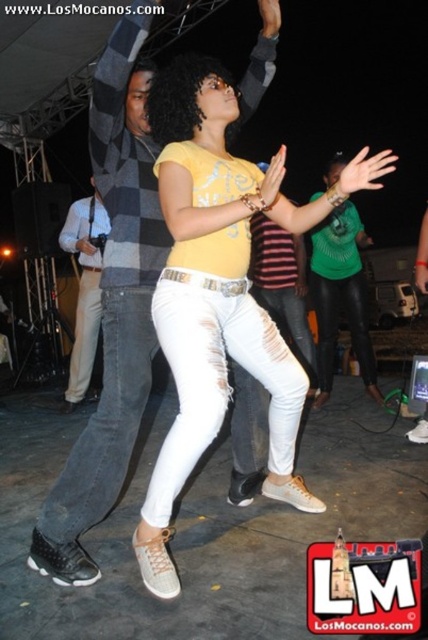
Between matte yellow shirt at center and green matte shirt at center, which one is positioned higher?

green matte shirt at center is higher up.

Can you confirm if matte yellow shirt at center is taller than green matte shirt at center?

In fact, matte yellow shirt at center may be shorter than green matte shirt at center.

Describe the element at coordinates (220, 292) in the screenshot. I see `matte yellow shirt at center` at that location.

The image size is (428, 640). In order to click on matte yellow shirt at center in this screenshot , I will do `click(220, 292)`.

Can you confirm if denim jeans at center is bigger than green matte shirt at center?

No.

Is denim jeans at center wider than green matte shirt at center?

In fact, denim jeans at center might be narrower than green matte shirt at center.

Is point (51, 556) behind point (329, 323)?

That is False.

Where is `denim jeans at center`? denim jeans at center is located at coordinates (112, 308).

Is green matte shirt at center below light blue shirt at left?

Incorrect, green matte shirt at center is not positioned below light blue shirt at left.

Does green matte shirt at center appear on the right side of light blue shirt at left?

Yes, green matte shirt at center is to the right of light blue shirt at left.

Locate an element on the screen. green matte shirt at center is located at coordinates (341, 296).